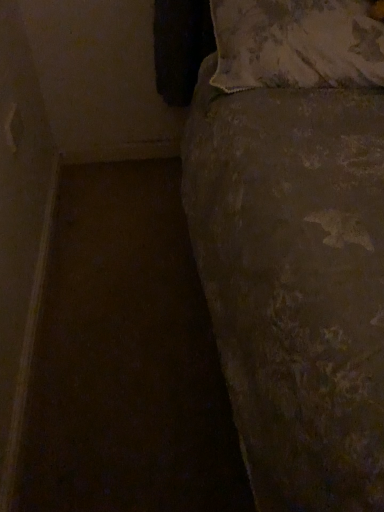
Question: Should I look upward or downward to see fluffy beige pillow at upper right?

Choices:
 (A) down
 (B) up

Answer: (B)